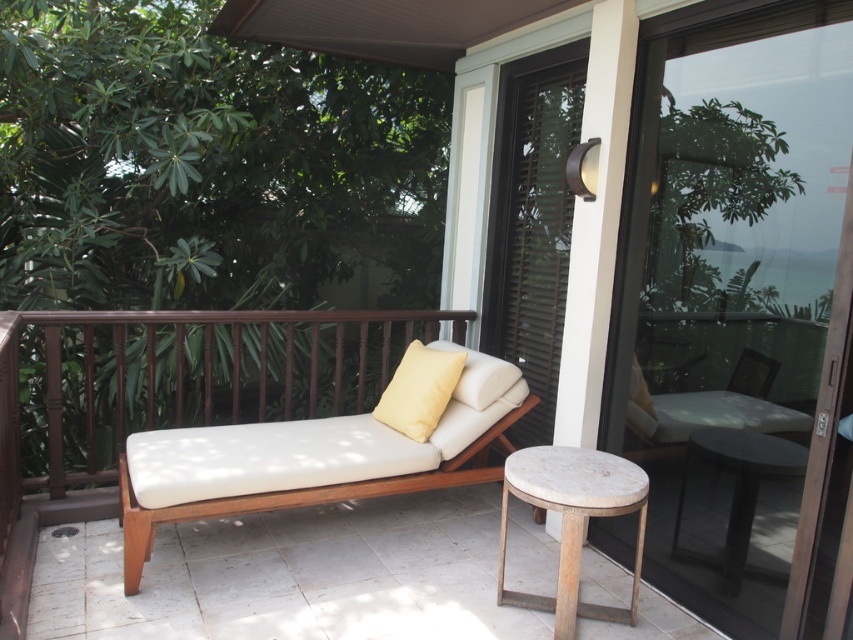
You are standing on the balcony and want to place a 1.2 meter long plant pot along the brown wood rail at center. Given the rail is 2 meters in length, can you fit the plant pot horizontally without overlapping the rail?

The brown wood rail at center is 2 meters long, and the plant pot is 1.2 meters long. Since 1.2 meters is less than 2 meters, the plant pot can fit horizontally along the rail without overlapping its edges.